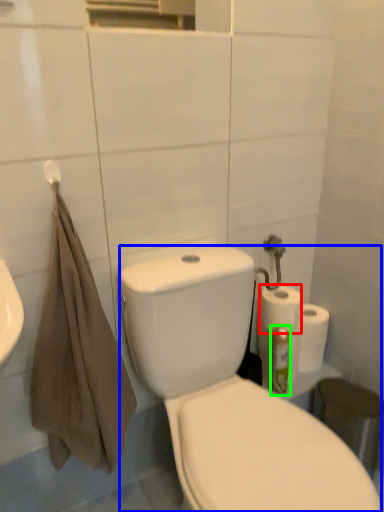
Question: Based on their relative distances, which object is nearer to paper towel (highlighted by a red box)? Choose from porcelain (highlighted by a blue box) and cleaning product (highlighted by a green box).

Choices:
 (A) porcelain
 (B) cleaning product

Answer: (B)